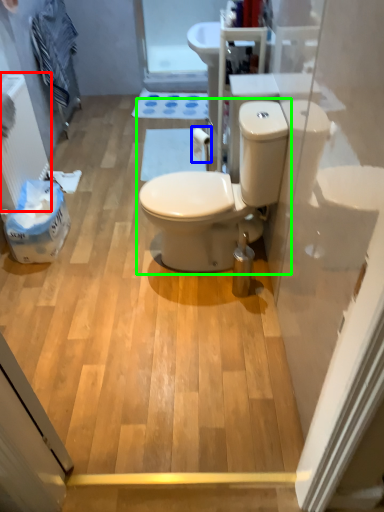
Question: Considering the real-world distances, which object is closest to radiator (highlighted by a red box)? toilet paper (highlighted by a blue box) or toilet (highlighted by a green box).

Choices:
 (A) toilet paper
 (B) toilet

Answer: (A)